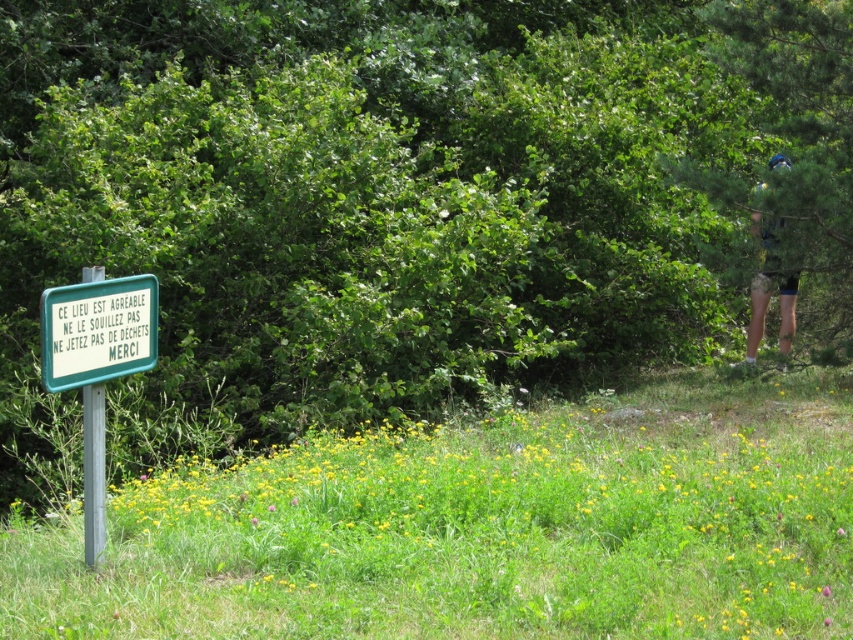
Question: Can you confirm if green metallic sign at left is bigger than camouflage shorts at right?

Choices:
 (A) yes
 (B) no

Answer: (B)

Question: Based on their relative distances, which object is farther from the green plastic sign at left?

Choices:
 (A) camouflage shorts at right
 (B) green grassy at left
 (C) green metallic sign at left

Answer: (A)

Question: Which point appears farthest from the camera in this image?

Choices:
 (A) (785, 308)
 (B) (339, 595)

Answer: (A)

Question: In this image, where is green grassy at left located relative to camouflage shorts at right?

Choices:
 (A) right
 (B) left

Answer: (B)

Question: Observing the image, what is the correct spatial positioning of green plastic sign at left in reference to camouflage shorts at right?

Choices:
 (A) right
 (B) left

Answer: (B)

Question: Which of the following is the farthest from the observer?

Choices:
 (A) (47, 292)
 (B) (810, 508)

Answer: (B)